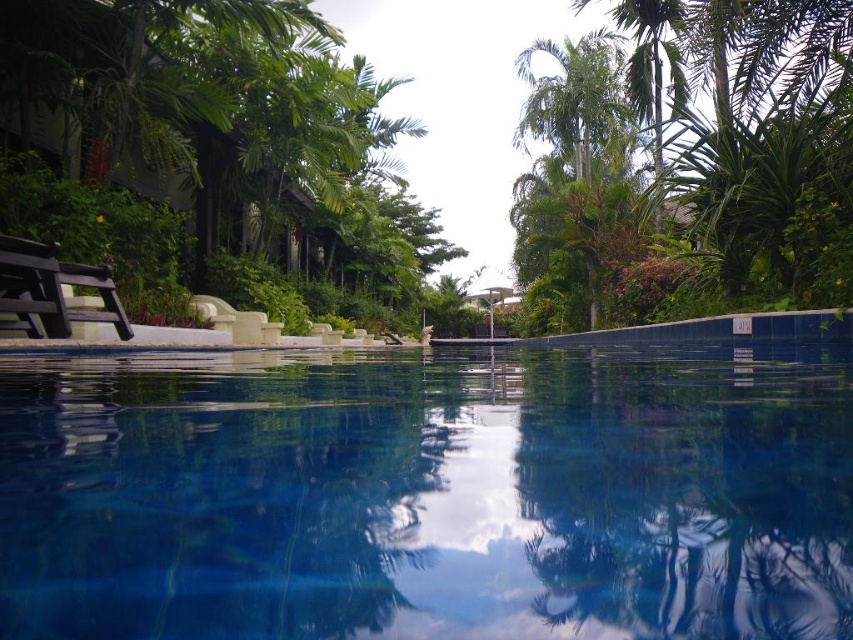
You are standing at the point marked as point (210,476) in the image. You want to place a 20 inch long bench here. Will it fit without overlapping any existing objects?

The distance between the points is 22.18 inches, which is greater than the 20 inch bench, so it will fit without overlapping existing objects.

You are standing at the edge of the pool and want to shade yourself under a tree. The green leafy tree at left and the green leafy palm tree at center are both options. Which tree is closer to you?

The green leafy tree at left is located below the green leafy palm tree at center, meaning it is closer to you. Therefore, the green leafy tree at left is the closer option for shade.

You are standing at the edge of the blue tile swimming pool at center and want to reach the dark brown wooden chair at left. Which direction should you walk to get there?

To reach the dark brown wooden chair at left from the blue tile swimming pool at center, you should walk to the left since the blue tile swimming pool at center is to the right of the dark brown wooden chair at left.